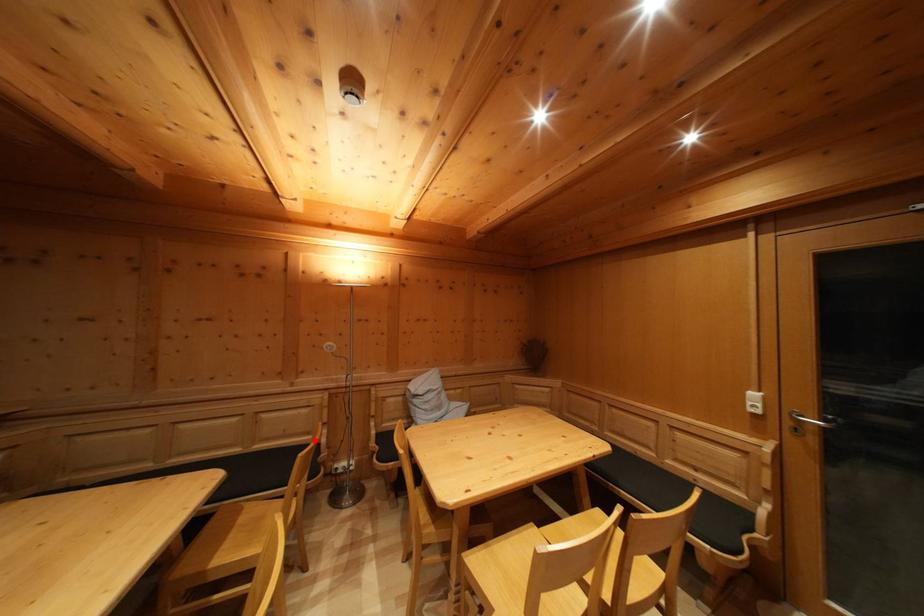
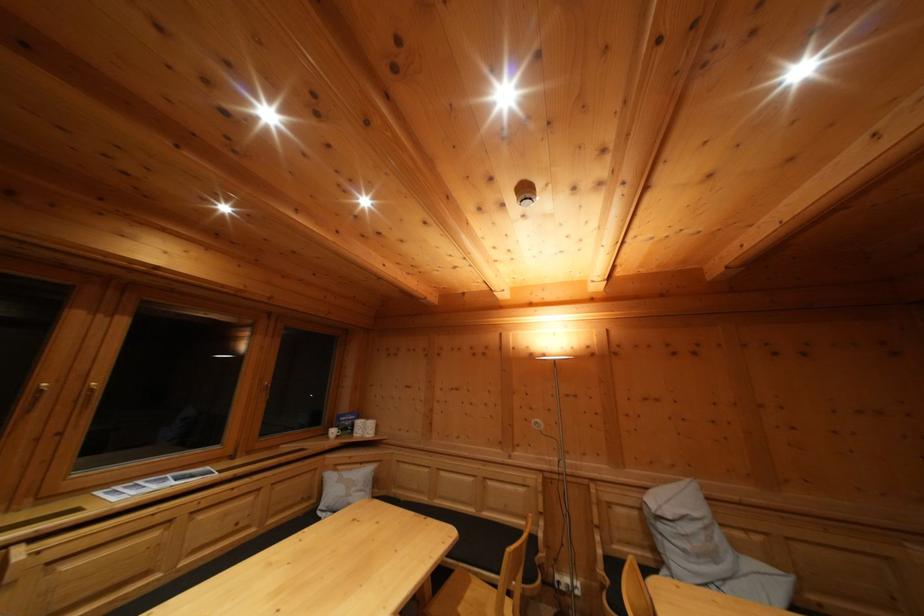
In the second image, find the point that corresponds to the highlighted location in the first image.

(532, 525)